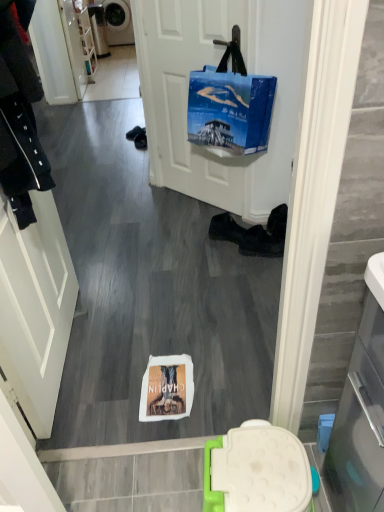
What is the approximate width of black leather shoes at center, which ranks as the first footwear in left-to-right order?

black leather shoes at center, which ranks as the first footwear in left-to-right order, is 6.37 inches wide.

Measure the distance between white paper bag at center and camera.

They are 1.57 meters apart.

You are a GUI agent. You are given a task and a screenshot of the screen. Output one action in this format:
    pyautogui.click(x=<x>, y=<y>)
    Task: Click on the matte white cabinet at upper left
    Image resolution: width=384 pixels, height=512 pixels.
    Given the screenshot: What is the action you would take?
    pyautogui.click(x=79, y=42)

Considering their positions, is white paper bag at center located in front of or behind white glossy door at left?

Clearly, white paper bag at center is behind white glossy door at left.

Locate an element on the screen. person below the white glossy door at left (from a real-world perspective) is located at coordinates (166, 390).

Is white paper bag at center turned away from white glossy door at left?

white paper bag at center is not turned away from white glossy door at left.

Does white paper bag at center have a lesser height compared to white glossy door at left?

Indeed, white paper bag at center has a lesser height compared to white glossy door at left.

From a real-world perspective, relative to black leather boots at lower center, the second footwear positioned from the left, is blue fabric bag at upper center vertically above or below?

Clearly, from a real-world perspective, blue fabric bag at upper center is above black leather boots at lower center, the second footwear positioned from the left.

Does blue fabric bag at upper center appear on the right side of black leather boots at lower center, arranged as the 1th footwear when viewed from the right?

Incorrect, blue fabric bag at upper center is not on the right side of black leather boots at lower center, arranged as the 1th footwear when viewed from the right.

Are blue fabric bag at upper center and black leather boots at lower center, arranged as the 1th footwear when viewed from the right, located far from each other?

No, there isn't a large distance between blue fabric bag at upper center and black leather boots at lower center, arranged as the 1th footwear when viewed from the right.

Is blue fabric bag at upper center smaller than black leather boots at lower center, arranged as the 1th footwear when viewed from the right?

No, blue fabric bag at upper center is not smaller than black leather boots at lower center, arranged as the 1th footwear when viewed from the right.

How different are the orientations of metallic gray washing machine at upper left and black leather boots at lower center, arranged as the 1th footwear when viewed from the right, in degrees?

metallic gray washing machine at upper left and black leather boots at lower center, arranged as the 1th footwear when viewed from the right, are facing 13.7 degrees away from each other.

Is metallic gray washing machine at upper left bigger than black leather boots at lower center, the second footwear positioned from the left?

Yes.

From a real-world perspective, between metallic gray washing machine at upper left and black leather boots at lower center, the second footwear positioned from the left, who is vertically higher?

From a 3D spatial view, metallic gray washing machine at upper left is above.

Looking at this image, is metallic gray washing machine at upper left next to black leather boots at lower center, arranged as the 1th footwear when viewed from the right?

metallic gray washing machine at upper left is not next to black leather boots at lower center, arranged as the 1th footwear when viewed from the right, and they're not touching.

Based on the photo, looking at their sizes, would you say white glossy door at left is wider or thinner than matte white cabinet at upper left?

Clearly, white glossy door at left has less width compared to matte white cabinet at upper left.

Considering the sizes of objects white glossy door at left and matte white cabinet at upper left in the image provided, who is taller, white glossy door at left or matte white cabinet at upper left?

matte white cabinet at upper left.

Based on the photo, based on their sizes in the image, would you say white glossy door at left is bigger or smaller than matte white cabinet at upper left?

Considering their sizes, white glossy door at left takes up less space than matte white cabinet at upper left.

From the image's perspective, which one is positioned lower, white glossy door at left or matte white cabinet at upper left?

white glossy door at left appears lower in the image.

Does matte white cabinet at upper left turn towards white paper bag at center?

No, matte white cabinet at upper left is not turned towards white paper bag at center.

How many degrees apart are the facing directions of matte white cabinet at upper left and white paper bag at center?

93.6 degrees.

Are matte white cabinet at upper left and white paper bag at center beside each other?

matte white cabinet at upper left is not next to white paper bag at center, and they're not touching.

Can you confirm if white matte door at center is thinner than white paper bag at center?

Correct, the width of white matte door at center is less than that of white paper bag at center.

In the image, there is a white matte door at center. Where is `person below it (from the image's perspective)`? person below it (from the image's perspective) is located at coordinates [166, 390].

From the image's perspective, is white matte door at center beneath white paper bag at center?

Incorrect, from the image's perspective, white matte door at center is higher than white paper bag at center.

From their relative heights in the image, would you say white matte door at center is taller or shorter than white paper bag at center?

Clearly, white matte door at center is taller compared to white paper bag at center.

Can you confirm if black leather shoe at lower center is wider than metallic gray washing machine at upper left?

No, black leather shoe at lower center is not wider than metallic gray washing machine at upper left.

Considering the positions of objects black leather shoe at lower center and metallic gray washing machine at upper left in the image provided, who is behind, black leather shoe at lower center or metallic gray washing machine at upper left?

metallic gray washing machine at upper left is more distant.

Considering the relative positions of black leather shoe at lower center and metallic gray washing machine at upper left in the image provided, is black leather shoe at lower center to the left of metallic gray washing machine at upper left from the viewer's perspective?

No.

Is black leather shoe at lower center taller or shorter than metallic gray washing machine at upper left?

Clearly, black leather shoe at lower center is shorter compared to metallic gray washing machine at upper left.

Where is `screen door on the left of the white paper bag at center`? screen door on the left of the white paper bag at center is located at coordinates (35, 308).

You are a GUI agent. You are given a task and a screenshot of the screen. Output one action in this format:
    pyautogui.click(x=<x>, y=<y>)
    Task: Click on the footwear that is the 2nd one when counting rightward from the blue fabric bag at upper center
    The width and height of the screenshot is (384, 512).
    Given the screenshot: What is the action you would take?
    pyautogui.click(x=261, y=242)

Considering their positions, is white paper bag at center positioned further to black leather shoes at center, which ranks as the first footwear in left-to-right order, than blue fabric bag at upper center?

white paper bag at center lies further to black leather shoes at center, which ranks as the first footwear in left-to-right order, than the other object.

When comparing their distances from blue fabric bag at upper center, does white paper bag at center or black leather shoe at lower center seem further?

The object further to blue fabric bag at upper center is white paper bag at center.

Estimate the real-world distances between objects in this image. Which object is closer to white paper bag at center, black leather shoe at lower center or black leather boots at lower center, arranged as the 1th footwear when viewed from the right?

Based on the image, black leather boots at lower center, arranged as the 1th footwear when viewed from the right, appears to be nearer to white paper bag at center.

When comparing their distances from black leather boots at lower center, arranged as the 1th footwear when viewed from the right, does white paper bag at center or metallic gray washing machine at upper left seem closer?

white paper bag at center.

Looking at the image, which one is located further to metallic gray washing machine at upper left, black leather shoes at center, acting as the 2th footwear starting from the right, or white matte door at center?

black leather shoes at center, acting as the 2th footwear starting from the right, lies further to metallic gray washing machine at upper left than the other object.

When comparing their distances from matte white cabinet at upper left, does black leather boots at lower center, arranged as the 1th footwear when viewed from the right, or blue fabric bag at upper center seem closer?

blue fabric bag at upper center lies closer to matte white cabinet at upper left than the other object.

From the image, which object appears to be nearer to black leather boots at lower center, the second footwear positioned from the left, white glossy door at left or black leather shoes at center, acting as the 2th footwear starting from the right?

Among the two, black leather shoes at center, acting as the 2th footwear starting from the right, is located nearer to black leather boots at lower center, the second footwear positioned from the left.

Which object lies nearer to the anchor point black leather boots at lower center, arranged as the 1th footwear when viewed from the right, matte white cabinet at upper left or black leather shoe at lower center?

black leather shoe at lower center is positioned closer to the anchor black leather boots at lower center, arranged as the 1th footwear when viewed from the right.

Find the location of `door located between blue fabric bag at upper center and matte white cabinet at upper left in the depth direction`. door located between blue fabric bag at upper center and matte white cabinet at upper left in the depth direction is located at coordinates (216, 64).

This screenshot has width=384, height=512. I want to click on shoe between blue fabric bag at upper center and black leather shoes at center, which ranks as the first footwear in left-to-right order, vertically, so click(278, 222).

Where is `door between white glossy door at left and metallic gray washing machine at upper left along the z-axis`? door between white glossy door at left and metallic gray washing machine at upper left along the z-axis is located at coordinates (216, 64).

Where is `screen door between white matte door at center and white paper bag at center from top to bottom`? Image resolution: width=384 pixels, height=512 pixels. screen door between white matte door at center and white paper bag at center from top to bottom is located at coordinates click(35, 308).